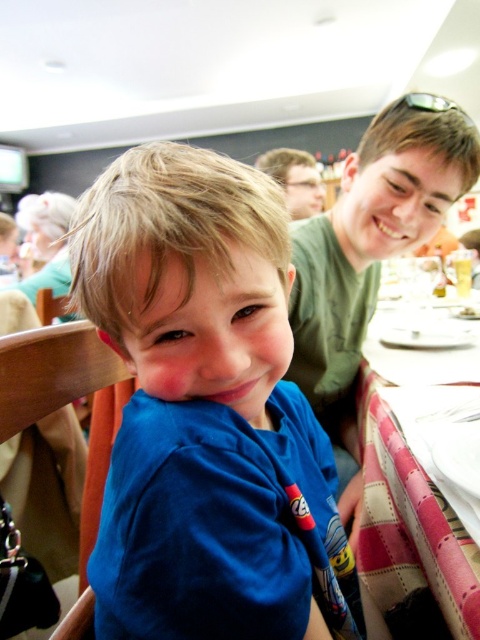
Question: Does blue cotton shirt at center have a lesser width compared to pink plaid tablecloth at lower right?

Choices:
 (A) no
 (B) yes

Answer: (A)

Question: Which point is closer to the camera?

Choices:
 (A) blue cotton shirt at right
 (B) blue cotton shirt at center
 (C) pink plaid tablecloth at lower right

Answer: (B)

Question: Considering the real-world distances, which object is farthest from the blue cotton shirt at center?

Choices:
 (A) blue cotton shirt at right
 (B) pink plaid tablecloth at lower right

Answer: (A)

Question: Which is farther from the blue cotton shirt at center?

Choices:
 (A) pink plaid tablecloth at lower right
 (B) blue cotton shirt at right

Answer: (B)

Question: Does blue cotton shirt at right have a larger size compared to pink plaid tablecloth at lower right?

Choices:
 (A) yes
 (B) no

Answer: (A)

Question: Considering the relative positions of blue cotton shirt at center and pink plaid tablecloth at lower right in the image provided, where is blue cotton shirt at center located with respect to pink plaid tablecloth at lower right?

Choices:
 (A) left
 (B) right

Answer: (A)